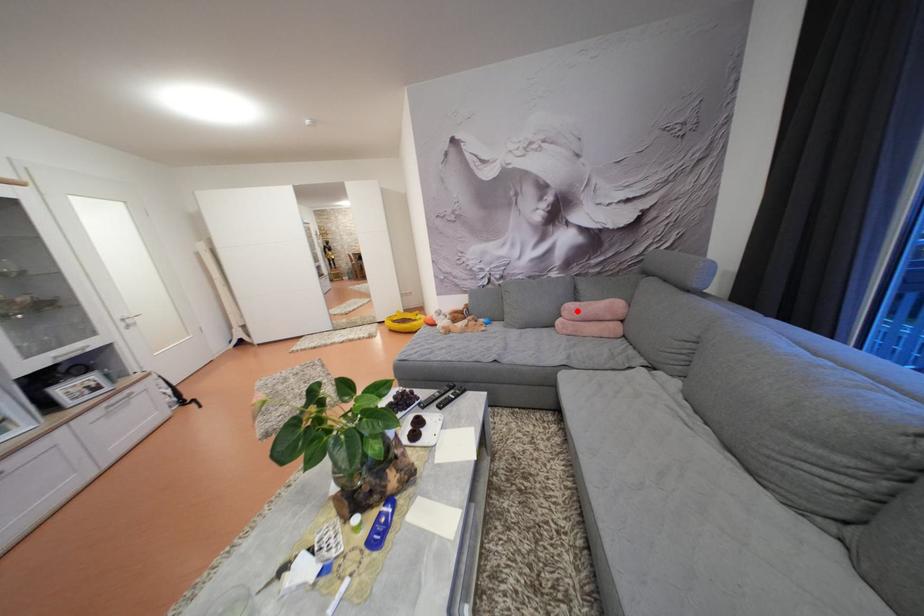
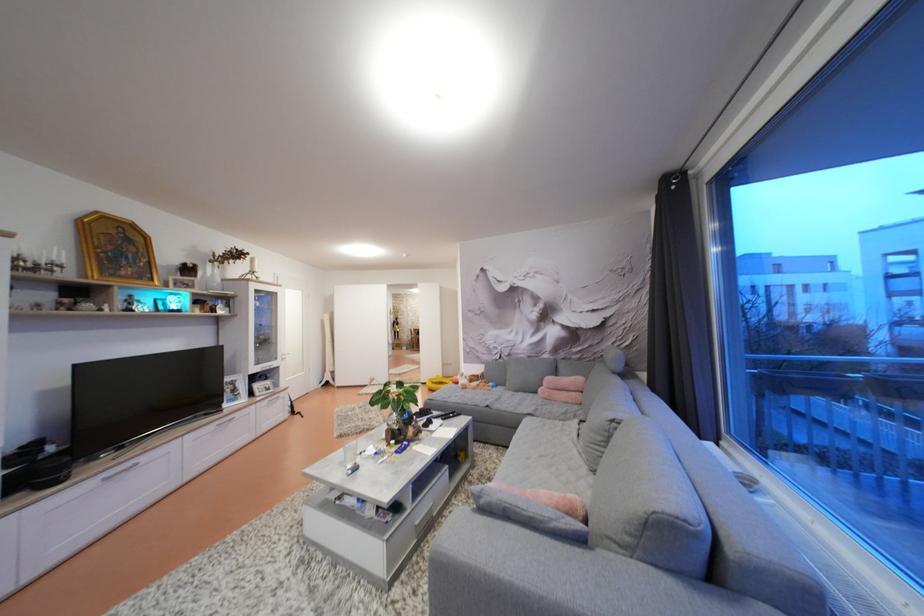
Question: I am providing you with two images of the same scene from different viewpoints. A red point is shown in image1. For the corresponding object point in image2, is it positioned nearer or farther from the camera?

Choices:
 (A) Nearer
 (B) Farther

Answer: (B)